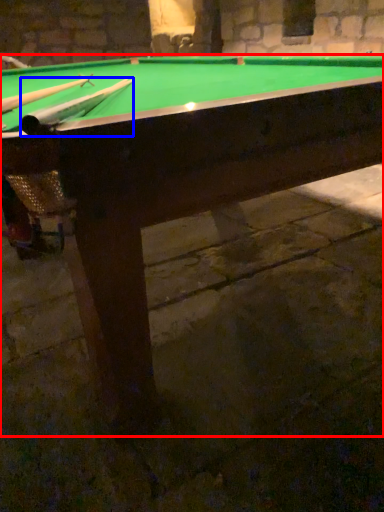
Question: Which object appears farthest to the camera in this image, billiard table (highlighted by a red box) or cue (highlighted by a blue box)?

Choices:
 (A) billiard table
 (B) cue

Answer: (B)